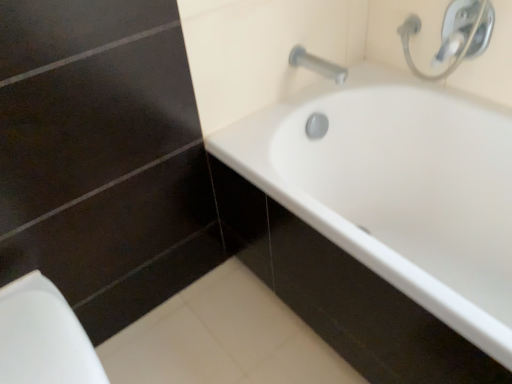
Question: Is white glossy bathtub at center turned away from silver metallic tap at upper right?

Choices:
 (A) yes
 (B) no

Answer: (B)

Question: Does white glossy bathtub at center have a greater height compared to silver metallic tap at upper right?

Choices:
 (A) yes
 (B) no

Answer: (A)

Question: Is white glossy bathtub at center wider than silver metallic tap at upper right?

Choices:
 (A) no
 (B) yes

Answer: (B)

Question: Is white glossy bathtub at center not near silver metallic tap at upper right?

Choices:
 (A) yes
 (B) no

Answer: (B)

Question: Can you confirm if white glossy bathtub at center is shorter than silver metallic tap at upper right?

Choices:
 (A) yes
 (B) no

Answer: (B)

Question: From the image's perspective, is white glossy porcelain at lower left located above or below silver metallic faucet at upper right?

Choices:
 (A) below
 (B) above

Answer: (A)

Question: Considering their positions, is white glossy porcelain at lower left located in front of or behind silver metallic faucet at upper right?

Choices:
 (A) front
 (B) behind

Answer: (A)

Question: Choose the correct answer: Is white glossy porcelain at lower left inside silver metallic faucet at upper right or outside it?

Choices:
 (A) inside
 (B) outside

Answer: (B)

Question: In terms of width, does white glossy porcelain at lower left look wider or thinner when compared to silver metallic faucet at upper right?

Choices:
 (A) wide
 (B) thin

Answer: (A)

Question: From the image's perspective, is white glossy porcelain at lower left located above or below silver metallic tap at upper right?

Choices:
 (A) below
 (B) above

Answer: (A)

Question: Is white glossy porcelain at lower left to the left or to the right of silver metallic tap at upper right in the image?

Choices:
 (A) left
 (B) right

Answer: (A)

Question: From a real-world perspective, is white glossy porcelain at lower left positioned above or below silver metallic tap at upper right?

Choices:
 (A) above
 (B) below

Answer: (B)

Question: Is white glossy porcelain at lower left taller or shorter than silver metallic tap at upper right?

Choices:
 (A) tall
 (B) short

Answer: (A)

Question: Is white glossy porcelain at lower left wider or thinner than white glossy bathtub at center?

Choices:
 (A) thin
 (B) wide

Answer: (A)

Question: From the image's perspective, is white glossy porcelain at lower left above or below white glossy bathtub at center?

Choices:
 (A) below
 (B) above

Answer: (A)